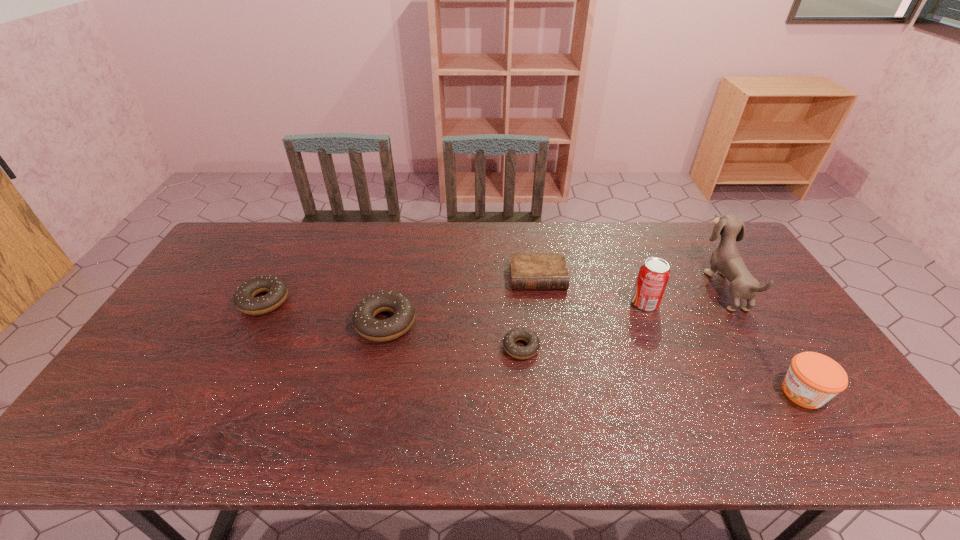
Image resolution: width=960 pixels, height=540 pixels. Find the location of `vacant space in between the puppy and the nearest object`. vacant space in between the puppy and the nearest object is located at coordinates (763, 339).

Where is `free space between the tallest object and the second doughnut from left to right`? free space between the tallest object and the second doughnut from left to right is located at coordinates (554, 305).

Find the location of a particular element. The image size is (960, 540). object that is the sixth closest one to the second tallest object is located at coordinates (244, 298).

Point out which object is positioned as the third nearest to the third tallest object. Please provide its 2D coordinates. Your answer should be formatted as a tuple, i.e. [(x, y)], where the tuple contains the x and y coordinates of a point satisfying the conditions above.

[(528, 270)]

At what (x,y) coordinates should I click in order to perform the action: click on doughnut identified as the second closest to the rightmost doughnut. Please return your answer as a coordinate pair (x, y). This screenshot has height=540, width=960. Looking at the image, I should click on (244, 298).

Locate which doughnut is the second closest to the jam. Please provide its 2D coordinates. Your answer should be formatted as a tuple, i.e. [(x, y)], where the tuple contains the x and y coordinates of a point satisfying the conditions above.

[(366, 325)]

The height and width of the screenshot is (540, 960). I want to click on free space that satisfies the following two spatial constraints: 1. on the front side of the second doughnut from left to right; 2. on the right side of the rightmost doughnut, so click(x=380, y=347).

The image size is (960, 540). I want to click on vacant region that satisfies the following two spatial constraints: 1. on the spine side of the fifth object from left to right; 2. on the right side of the diary, so click(541, 303).

Identify the location of free location that satisfies the following two spatial constraints: 1. on the front side of the shortest doughnut; 2. on the right side of the leftmost doughnut. (239, 347).